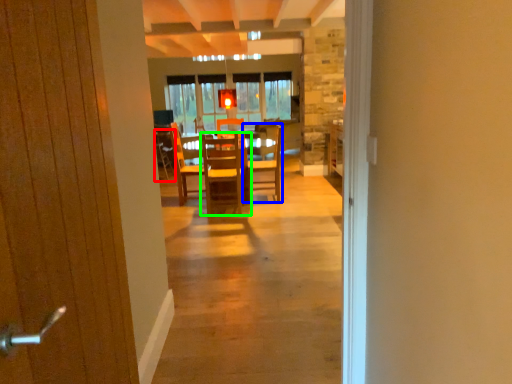
Question: Which object is the farthest from armchair (highlighted by a red box)? Choose among these: chair (highlighted by a blue box) or chair (highlighted by a green box).

Choices:
 (A) chair
 (B) chair

Answer: (A)